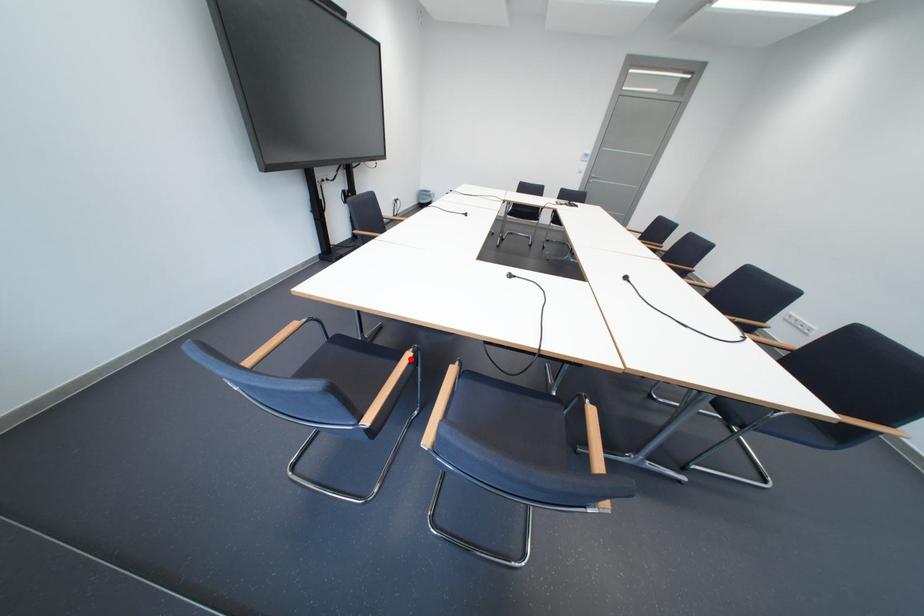
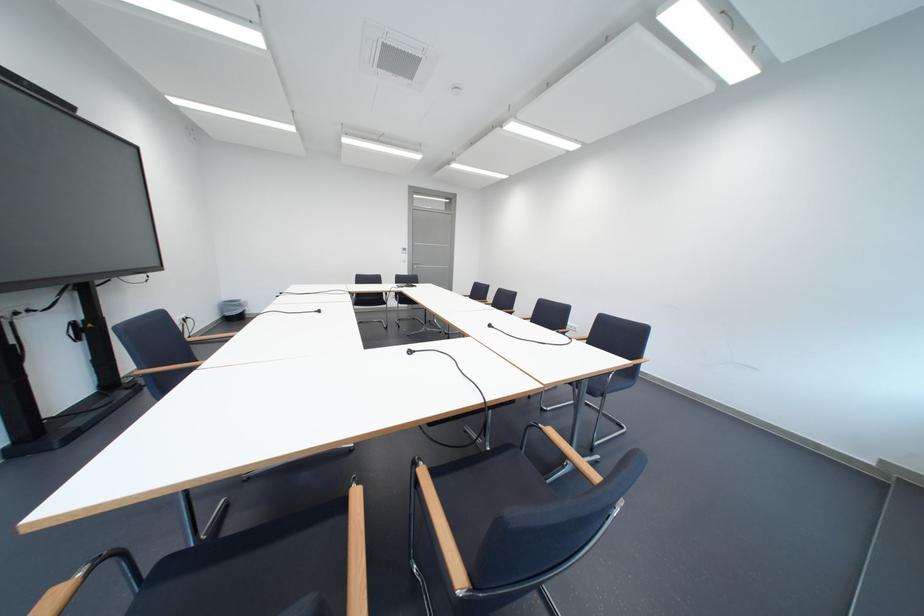
Where in the second image is the point corresponding to the highlighted location from the first image?

(355, 508)